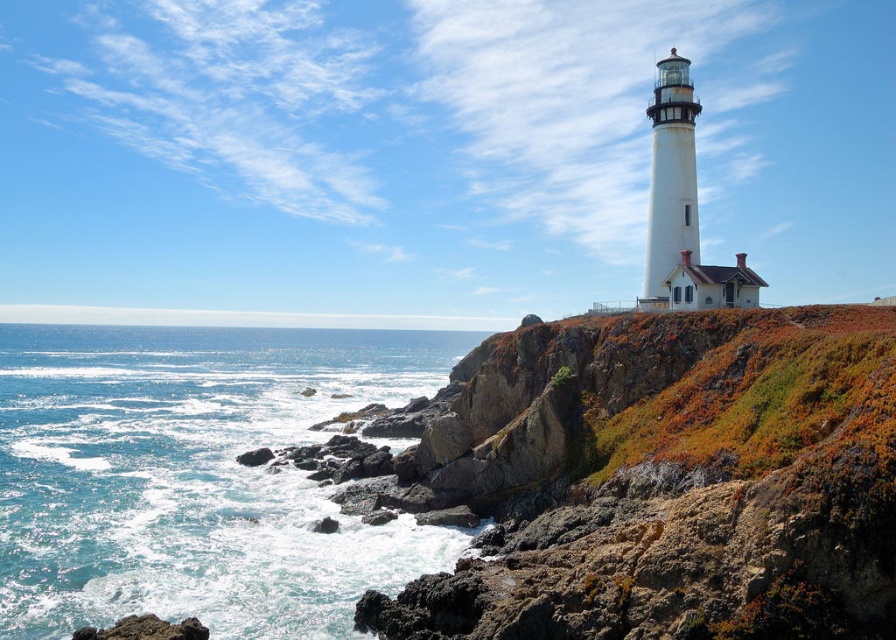
Question: Is the position of blue water at lower left less distant than that of rough textured rock at lower left?

Choices:
 (A) yes
 (B) no

Answer: (B)

Question: Which point is farther to the camera?

Choices:
 (A) (151, 632)
 (B) (325, 397)

Answer: (B)

Question: Which object is farther from the camera taking this photo?

Choices:
 (A) rough textured rock at lower left
 (B) blue water at lower left

Answer: (B)

Question: Which point appears farthest from the camera in this image?

Choices:
 (A) (171, 627)
 (B) (208, 483)

Answer: (B)

Question: Is blue water at lower left positioned in front of rough textured rock at lower left?

Choices:
 (A) no
 (B) yes

Answer: (A)

Question: Can you confirm if blue water at lower left is wider than rough textured rock at lower left?

Choices:
 (A) yes
 (B) no

Answer: (A)